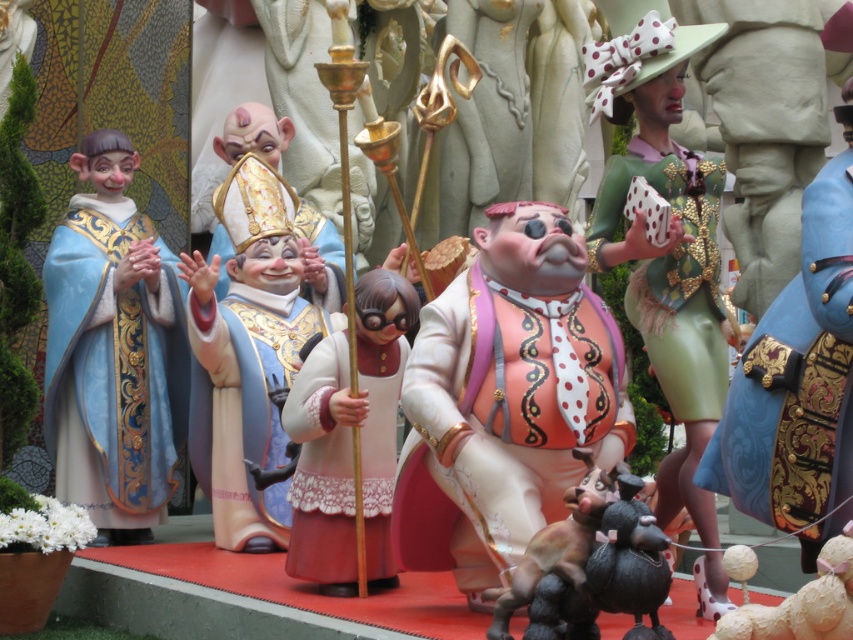
You are an event organizer arranging a photo shoot for the figurines. You need to place a 1.2 meter wide backdrop behind the matte blue fabric at left and the green fabric dress at upper right. Based on their widths, which figurine requires a wider section of the backdrop?

The matte blue fabric at left requires a wider section of the backdrop because its width surpasses that of the green fabric dress at upper right.